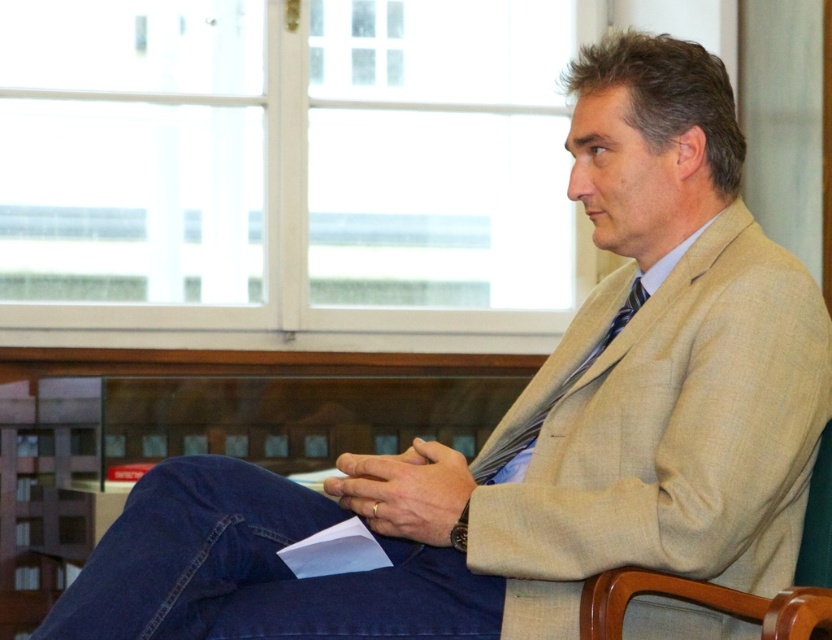
Is light brown wood chair at center further to camera compared to silky blue tie at center?

That is False.

Consider the image. Who is taller, light brown wood chair at center or silky blue tie at center?

With more height is silky blue tie at center.

Is point (811, 596) more distant than point (511, 481)?

No.

I want to click on light brown wood chair at center, so click(x=731, y=588).